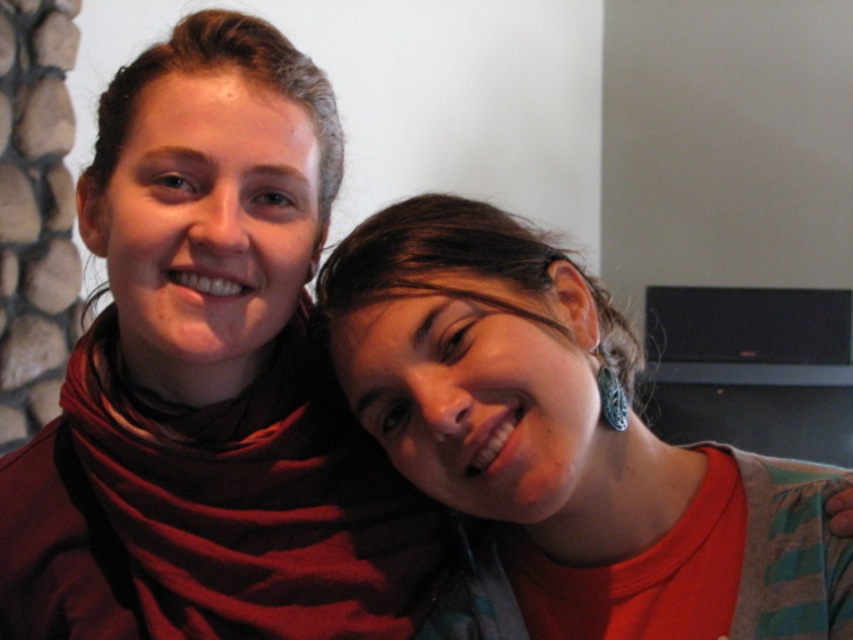
Question: Which of the following is the closest to the observer?

Choices:
 (A) [x=544, y=557]
 (B) [x=236, y=544]

Answer: (A)

Question: Does matte red scarf at upper left have a larger size compared to teal earrings at upper right?

Choices:
 (A) yes
 (B) no

Answer: (A)

Question: Which point is closer to the camera?

Choices:
 (A) (369, 294)
 (B) (26, 556)

Answer: (A)

Question: Does matte red scarf at upper left appear on the right side of teal earrings at upper right?

Choices:
 (A) no
 (B) yes

Answer: (A)

Question: Which point is closer to the camera taking this photo?

Choices:
 (A) (567, 628)
 (B) (277, 179)

Answer: (B)

Question: Can you confirm if matte red scarf at upper left is smaller than teal earrings at upper right?

Choices:
 (A) yes
 (B) no

Answer: (B)